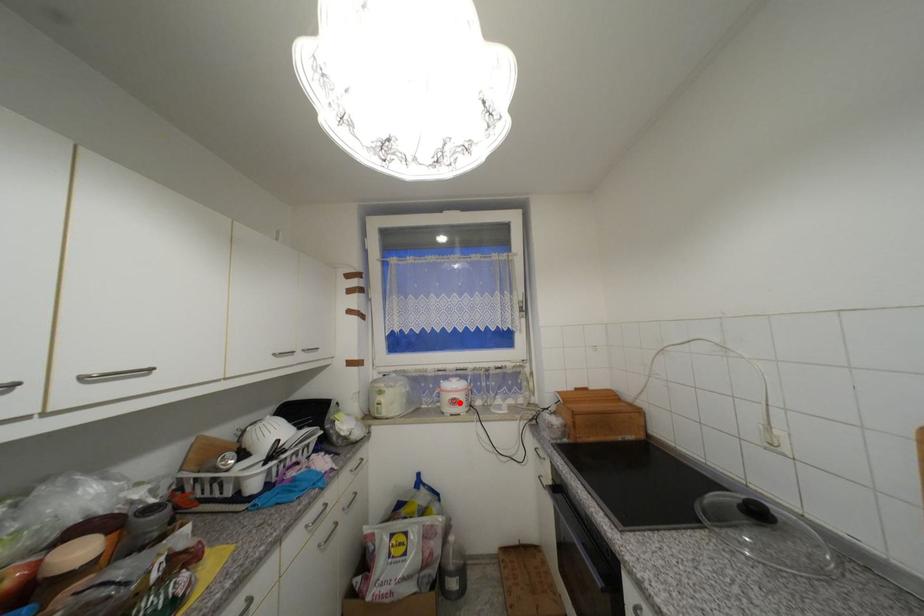
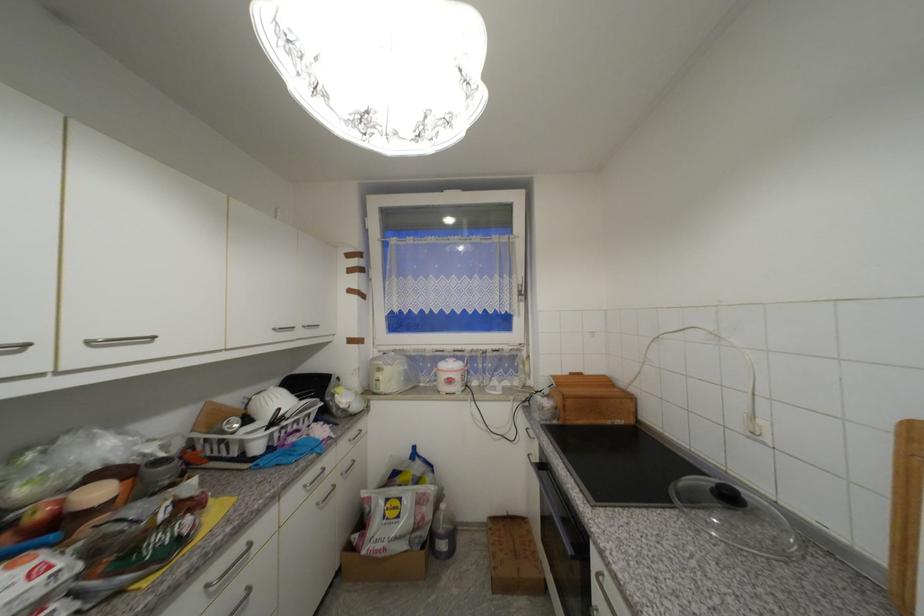
In the second image, find the point that corresponds to the highlighted location in the first image.

(456, 382)